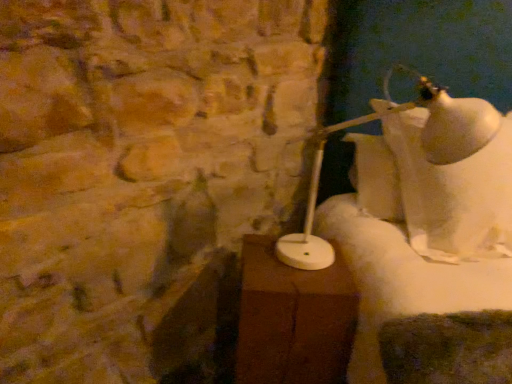
Question: From a real-world perspective, does white glossy lamp at right sit lower than brown wood table at center?

Choices:
 (A) yes
 (B) no

Answer: (B)

Question: Is white glossy lamp at right thinner than brown wood table at center?

Choices:
 (A) no
 (B) yes

Answer: (A)

Question: Is white glossy lamp at right not near brown wood table at center?

Choices:
 (A) no
 (B) yes

Answer: (A)

Question: Does white glossy lamp at right contain brown wood table at center?

Choices:
 (A) yes
 (B) no

Answer: (B)

Question: Is white glossy lamp at right at the right side of brown wood table at center?

Choices:
 (A) yes
 (B) no

Answer: (A)

Question: Can we say white glossy lamp at right lies outside brown wood table at center?

Choices:
 (A) yes
 (B) no

Answer: (A)

Question: From the image's perspective, is brown wood table at center located above white glossy lamp at right?

Choices:
 (A) no
 (B) yes

Answer: (A)

Question: Can you confirm if brown wood table at center is bigger than white glossy lamp at right?

Choices:
 (A) yes
 (B) no

Answer: (B)

Question: Does brown wood table at center have a lesser width compared to white glossy lamp at right?

Choices:
 (A) yes
 (B) no

Answer: (A)

Question: Is white glossy lamp at right at the back of brown wood table at center?

Choices:
 (A) yes
 (B) no

Answer: (B)

Question: From a real-world perspective, is brown wood table at center over white glossy lamp at right?

Choices:
 (A) no
 (B) yes

Answer: (A)

Question: Is brown wood table at center not near white glossy lamp at right?

Choices:
 (A) no
 (B) yes

Answer: (A)

Question: From a real-world perspective, is brown wood table at center positioned above or below white glossy lamp at right?

Choices:
 (A) below
 (B) above

Answer: (A)